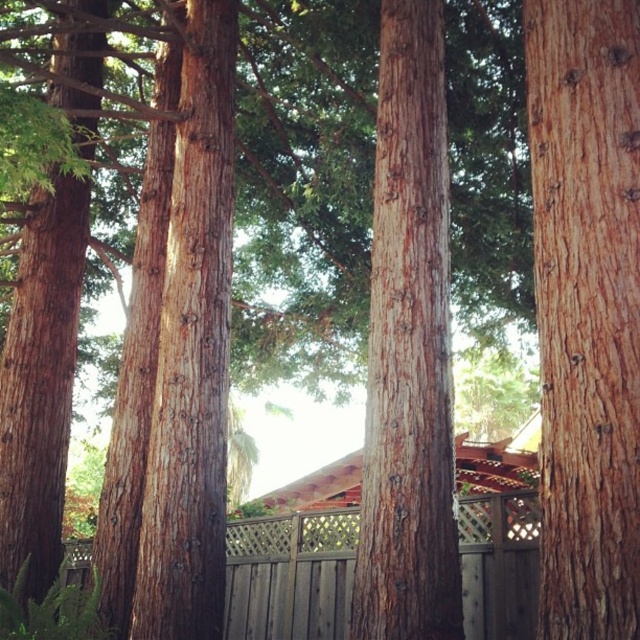
Question: Which of the following is the closest to the observer?

Choices:
 (A) (499, 528)
 (B) (177, 280)
 (C) (637, 355)
 (D) (412, 552)

Answer: (C)

Question: Can you confirm if smooth brown tree trunk at center is positioned to the right of wooden lattice fence at center?

Choices:
 (A) no
 (B) yes

Answer: (A)

Question: Does smooth brown bark at right appear on the left side of smooth brown tree trunk at center?

Choices:
 (A) yes
 (B) no

Answer: (B)

Question: In this image, where is brown textured wood at center located relative to wooden lattice fence at center?

Choices:
 (A) right
 (B) left

Answer: (A)

Question: Which object is farther from the camera taking this photo?

Choices:
 (A) wooden lattice fence at center
 (B) brown textured wood at center
 (C) smooth brown bark at right
 (D) smooth brown tree trunk at center

Answer: (A)

Question: Which object is the farthest from the smooth brown bark at right?

Choices:
 (A) smooth brown tree trunk at center
 (B) brown textured wood at center
 (C) wooden lattice fence at center

Answer: (C)